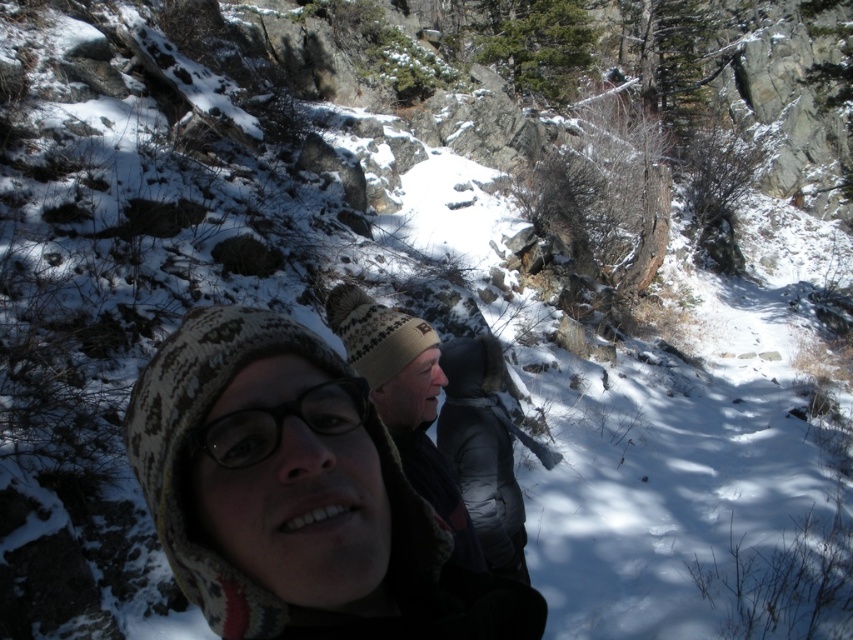
Question: Does knitted wool hat at center appear on the left side of black matte glasses at center?

Choices:
 (A) yes
 (B) no

Answer: (B)

Question: Which object appears closest to the camera in this image?

Choices:
 (A) black matte glasses at center
 (B) knitted wool hat at center

Answer: (B)

Question: Can you confirm if knitted wool hat at center is positioned to the right of black matte glasses at center?

Choices:
 (A) no
 (B) yes

Answer: (B)

Question: Is knitted wool hat at center smaller than black matte glasses at center?

Choices:
 (A) no
 (B) yes

Answer: (A)

Question: Among these points, which one is farthest from the camera?

Choices:
 (A) (308, 388)
 (B) (210, 540)

Answer: (A)